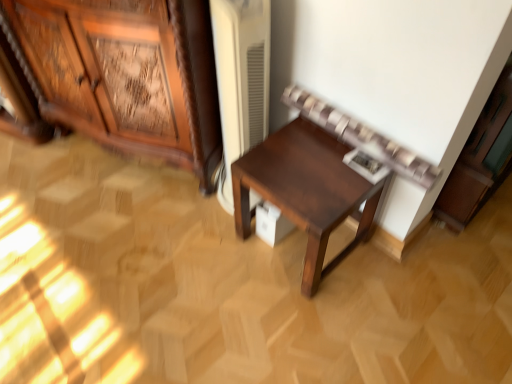
Question: Is white matte cabinet at upper right, placed as the 2th cabinetry when sorted from left to right, wider or thinner than wooden carved cabinet at left, the first cabinetry viewed from the left?

Choices:
 (A) wide
 (B) thin

Answer: (B)

Question: In terms of size, does white matte cabinet at upper right, arranged as the 1th cabinetry when viewed from the right, appear bigger or smaller than wooden carved cabinet at left, which is counted as the 2th cabinetry, starting from the right?

Choices:
 (A) small
 (B) big

Answer: (A)

Question: Which is farther from the white matte cabinet at upper right, arranged as the 1th cabinetry when viewed from the right?

Choices:
 (A) wooden carved cabinet at left, which is counted as the 2th cabinetry, starting from the right
 (B) dark wood table at center

Answer: (A)

Question: Estimate the real-world distances between objects in this image. Which object is farther from the white matte cabinet at upper right, placed as the 2th cabinetry when sorted from left to right?

Choices:
 (A) wooden carved cabinet at left, which is counted as the 2th cabinetry, starting from the right
 (B) dark wood table at center

Answer: (A)